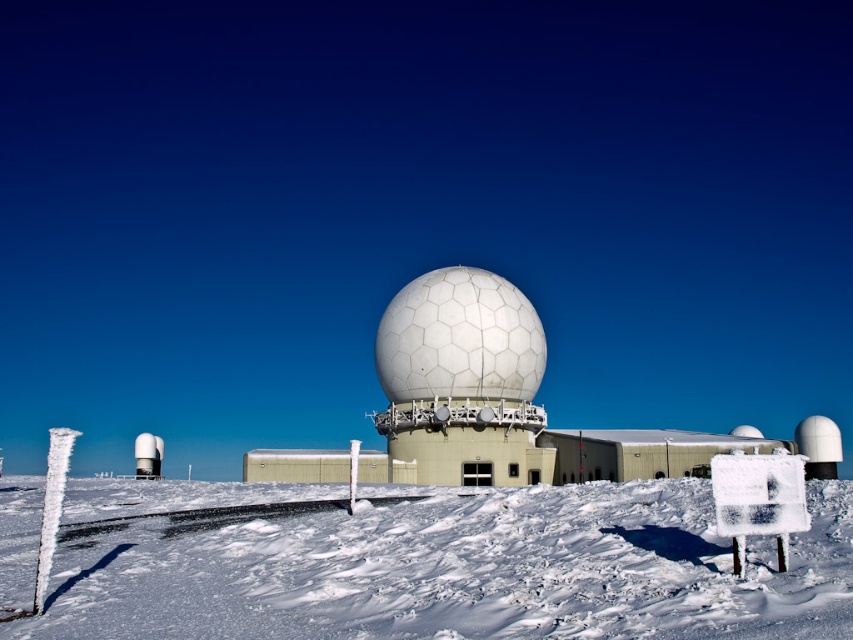
Can you confirm if white powdery snow at lower center is thinner than white hexagonal dome at center?

No.

Between white powdery snow at lower center and white hexagonal dome at center, which one is positioned higher?

white hexagonal dome at center is above.

The image size is (853, 640). What do you see at coordinates (462, 570) in the screenshot?
I see `white powdery snow at lower center` at bounding box center [462, 570].

Where is `white powdery snow at lower center`? white powdery snow at lower center is located at coordinates (462, 570).